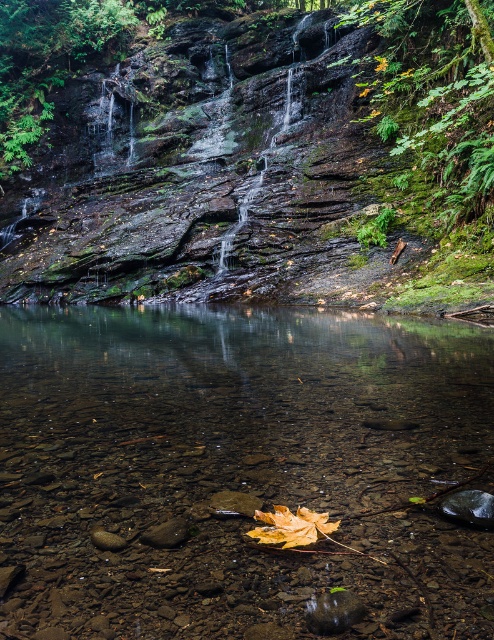
Is yellow matte maple leaf at lower center bigger than smooth brown rock at lower center?

Yes, yellow matte maple leaf at lower center is bigger than smooth brown rock at lower center.

Is yellow matte maple leaf at lower center further to camera compared to smooth brown rock at lower center?

No, it is in front of smooth brown rock at lower center.

Where is `yellow matte maple leaf at lower center`? This screenshot has height=640, width=494. yellow matte maple leaf at lower center is located at coordinates (291, 525).

Image resolution: width=494 pixels, height=640 pixels. I want to click on yellow matte maple leaf at lower center, so click(291, 525).

Which is more to the left, clear glass stream at center or green mossy rock at upper center?

From the viewer's perspective, green mossy rock at upper center appears more on the left side.

Who is more forward, [131,349] or [411,40]?

Positioned in front is point [131,349].

Between point (165, 496) and point (183, 44), which one is positioned in front?

Point (165, 496) is more forward.

At what (x,y) coordinates should I click in order to perform the action: click on clear glass stream at center. Please return your answer as a coordinate pair (x, y). The height and width of the screenshot is (640, 494). Looking at the image, I should click on (237, 468).

Does clear glass stream at center have a greater width compared to yellow matte maple leaf at lower center?

Indeed, clear glass stream at center has a greater width compared to yellow matte maple leaf at lower center.

Does clear glass stream at center have a larger size compared to yellow matte maple leaf at lower center?

No.

Image resolution: width=494 pixels, height=640 pixels. What are the coordinates of `clear glass stream at center` in the screenshot? It's located at (237, 468).